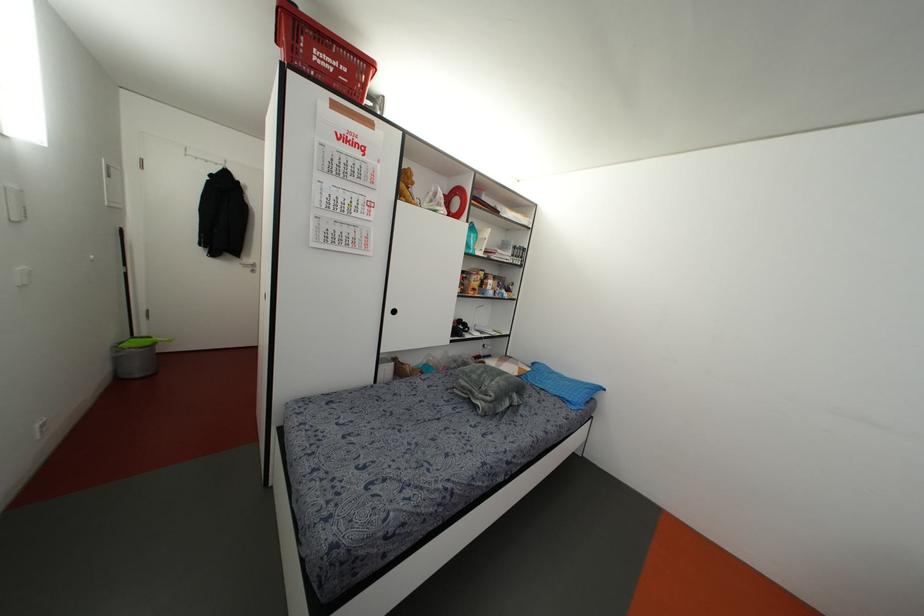
The location [131,304] corresponds to which object?

It refers to a long handle broom.